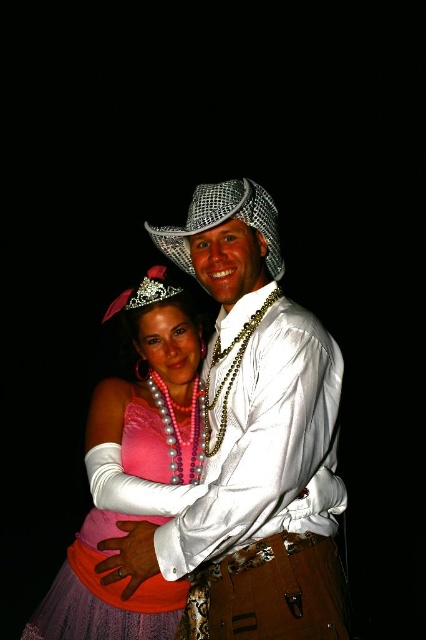
You are a photographer setting up for a photoshoot and need to position a spotlight between the satin white shirt at center and the glittery metallic cowboy hat at center. Based on their positions, which object should the spotlight be placed to the left of?

The spotlight should be placed to the left of the glittery metallic cowboy hat at center because the satin white shirt at center is located to its left side. Since the shirt is to the left of the hat, placing the spotlight to the left of the hat would position it between them.

You are a photographer adjusting the lighting for a photo shoot. You notice the satin white shirt at center and the glittery metallic cowboy hat at center. Which object should you focus your spotlight on to ensure it appears brighter in the final image?

The satin white shirt at center is in front of the glittery metallic cowboy hat at center, so focusing the spotlight on the satin white shirt at center will make it appear brighter in the final image.

You are attending a costume party and need to find your date who is wearing the glittery metallic cowboy hat at center. From the perspective of someone standing in front of the pink satin dress at center, which direction should you look to find your date?

The glittery metallic cowboy hat at center is to the right of the pink satin dress at center, so you should look to your right to find your date.